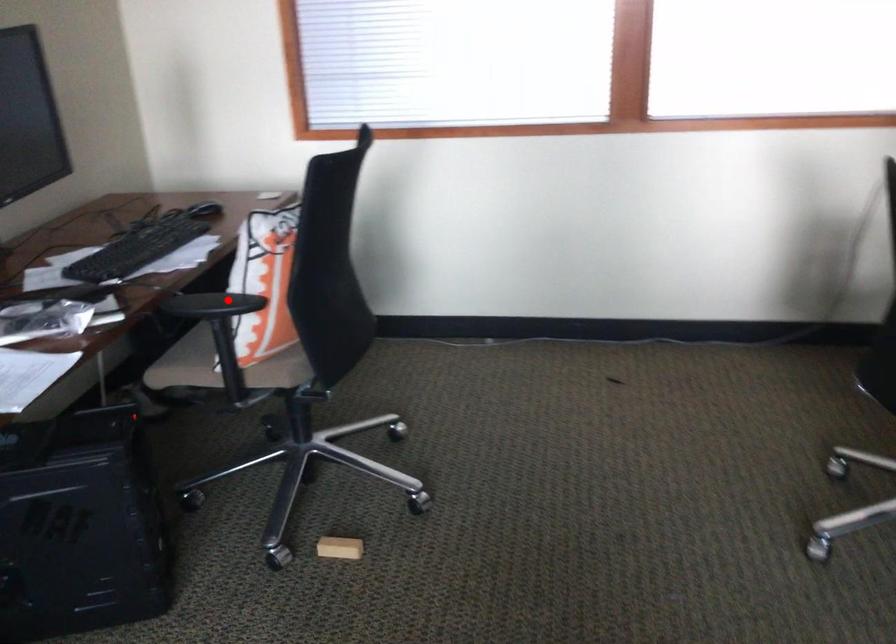
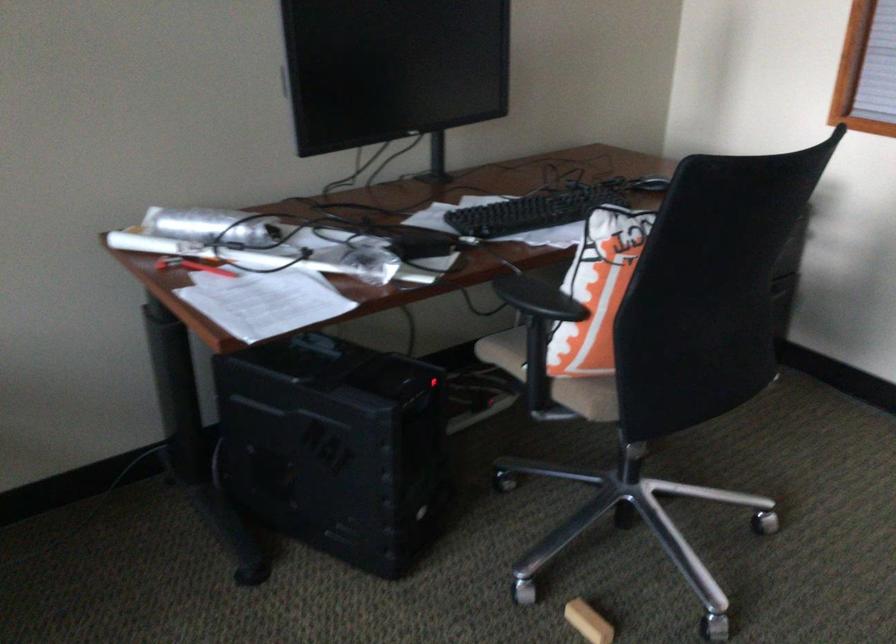
The point at the highlighted location is marked in the first image. Where is the corresponding point in the second image?

(538, 299)